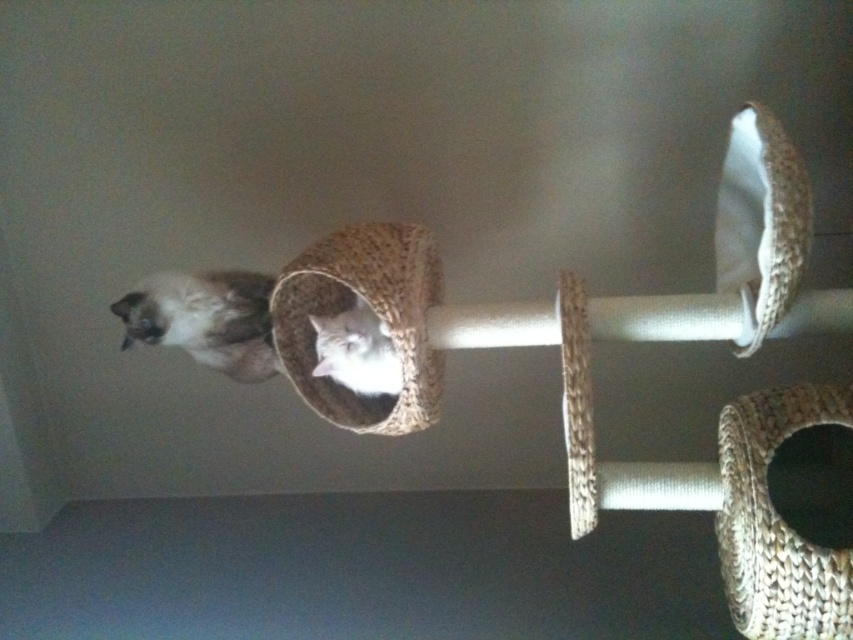
You are a cat owner who wants to ensure your cats can comfortably rest on the cat tree. Given the natural woven cat bed at center and the white soft cat at center, which object is taller and why?

The natural woven cat bed at center is taller than the white soft cat at center because the description states that the natural woven cat bed at center is taller than the white soft cat at center.

You are trying to place a new toy for the cats on the cat tree. The natural woven cat bed at center is located at point (373, 308). Where should you place the toy so that it is directly above the natural woven cat bed at center?

The toy should be placed directly above the natural woven cat bed at center at point (373, 308), so the coordinates would be approximately (373, 308) minus a small vertical adjustment to ensure it is above the bed.

You are a cat owner trying to choose a bed for your cat. You have the natural woven cat bed at center and the white soft cat at center. Which bed can comfortably accommodate your cat based on size?

The natural woven cat bed at center is larger in size than the white soft cat at center, so it can comfortably accommodate the cat.